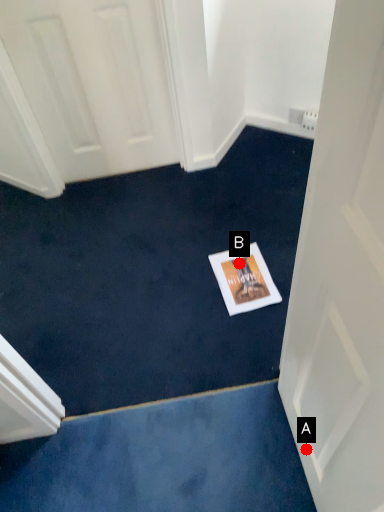
Question: Two points are circled on the image, labeled by A and B beside each circle. Which point is closer to the camera taking this photo?

Choices:
 (A) A is closer
 (B) B is closer

Answer: (A)